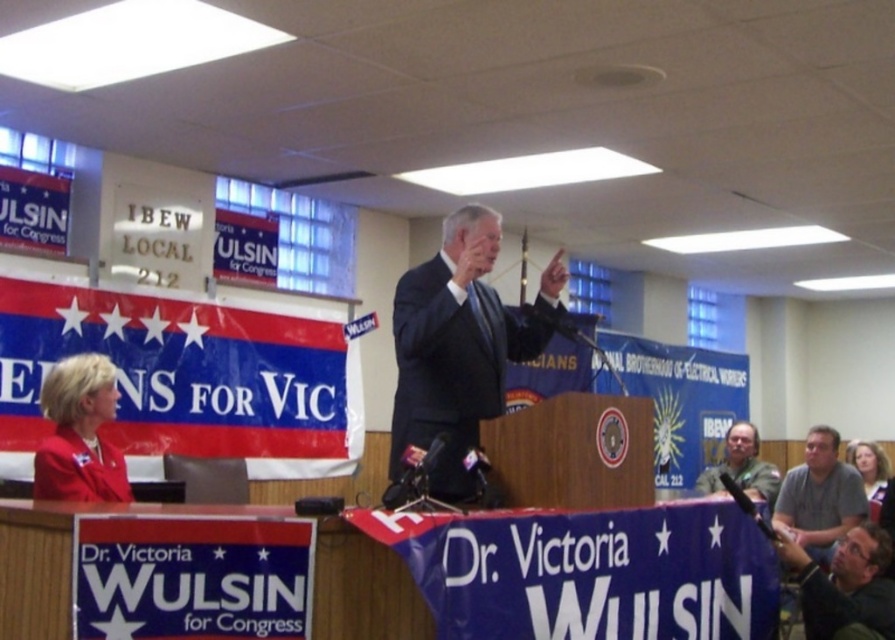
Looking at this image, you are standing at the back of the rally and want to locate the two men mentioned. Which one is positioned to the left when looking at the dark suit at center and gray casual shirt at lower right?

The dark suit at center is to the left of the gray casual shirt at lower right.

You are a photographer at the event and need to capture a clear photo of the dark suit at center without the green fabric shirt at lower right appearing in the frame. Is this possible given their positions?

The dark suit at center is positioned over the green fabric shirt at lower right, so it is possible to capture a clear photo of the dark suit at center without the green fabric shirt at lower right by focusing on the upper area where the dark suit is located.